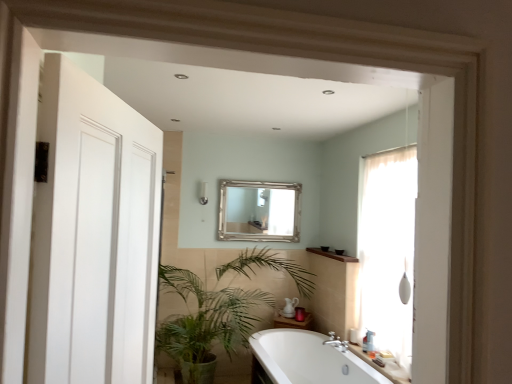
Question: Does silver metallic mirror at upper center come in front of white plastic bottle at lower right?

Choices:
 (A) no
 (B) yes

Answer: (A)

Question: From the image's perspective, would you say silver metallic mirror at upper center is positioned over white plastic bottle at lower right?

Choices:
 (A) yes
 (B) no

Answer: (A)

Question: Is silver metallic mirror at upper center completely or partially outside of white plastic bottle at lower right?

Choices:
 (A) no
 (B) yes

Answer: (B)

Question: From a real-world perspective, is silver metallic mirror at upper center positioned under white plastic bottle at lower right based on gravity?

Choices:
 (A) no
 (B) yes

Answer: (A)

Question: Is silver metallic mirror at upper center looking in the opposite direction of white plastic bottle at lower right?

Choices:
 (A) yes
 (B) no

Answer: (B)

Question: Is point (380, 253) closer or farther from the camera than point (369, 329)?

Choices:
 (A) farther
 (B) closer

Answer: (B)

Question: From the image's perspective, is translucent fabric curtain at right located above or below white plastic bottle at lower right?

Choices:
 (A) above
 (B) below

Answer: (A)

Question: Is translucent fabric curtain at right bigger or smaller than white plastic bottle at lower right?

Choices:
 (A) small
 (B) big

Answer: (B)

Question: Visually, is translucent fabric curtain at right positioned to the left or to the right of white plastic bottle at lower right?

Choices:
 (A) left
 (B) right

Answer: (B)

Question: Looking at their shapes, would you say silver metallic mirror at upper center is wider or thinner than white glossy bathtub at center?

Choices:
 (A) thin
 (B) wide

Answer: (A)

Question: Considering the relative positions of silver metallic mirror at upper center and white glossy bathtub at center in the image provided, is silver metallic mirror at upper center to the left or to the right of white glossy bathtub at center?

Choices:
 (A) right
 (B) left

Answer: (B)

Question: From a real-world perspective, is silver metallic mirror at upper center physically located above or below white glossy bathtub at center?

Choices:
 (A) above
 (B) below

Answer: (A)

Question: From the image's perspective, relative to white glossy bathtub at center, is silver metallic mirror at upper center above or below?

Choices:
 (A) below
 (B) above

Answer: (B)

Question: Is translucent fabric curtain at right in front of or behind white glossy counter top at lower right in the image?

Choices:
 (A) front
 (B) behind

Answer: (A)

Question: In terms of size, does translucent fabric curtain at right appear bigger or smaller than white glossy counter top at lower right?

Choices:
 (A) big
 (B) small

Answer: (A)